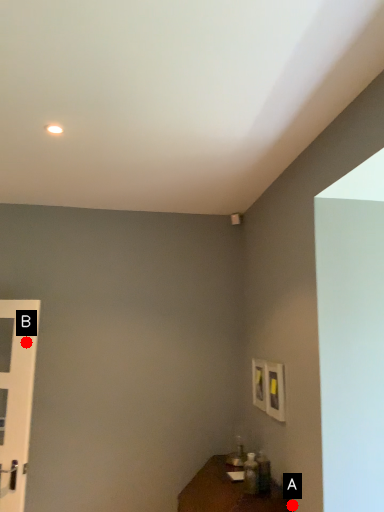
Question: Two points are circled on the image, labeled by A and B beside each circle. Which point is closer to the camera taking this photo?

Choices:
 (A) A is closer
 (B) B is closer

Answer: (A)